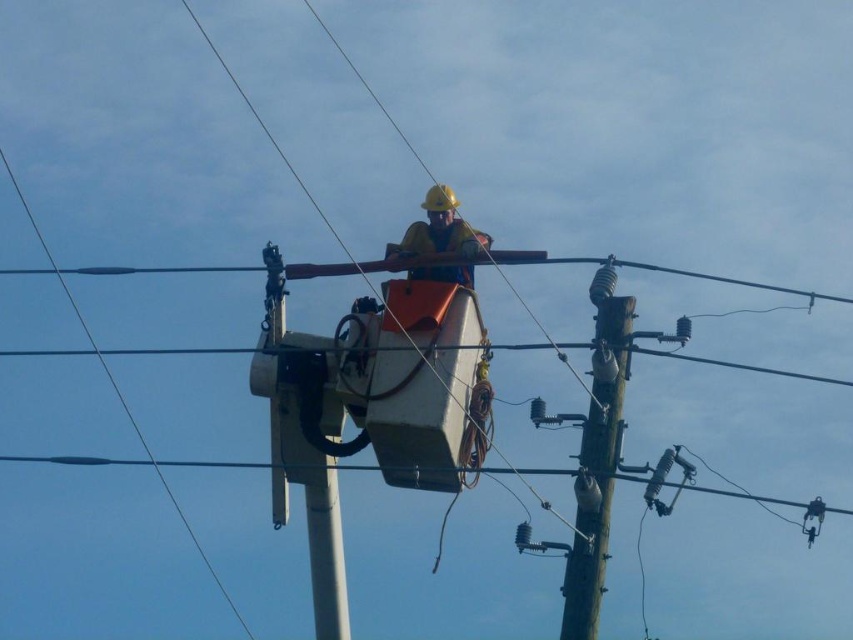
Is point (590, 545) closer to viewer compared to point (432, 198)?

Yes, point (590, 545) is closer to viewer.

Based on the photo, is wooden telegraph pole at center above yellow hard hat at center?

Actually, wooden telegraph pole at center is below yellow hard hat at center.

Is point (572, 547) behind point (450, 248)?

No, (572, 547) is in front of (450, 248).

I want to click on wooden telegraph pole at center, so click(x=596, y=458).